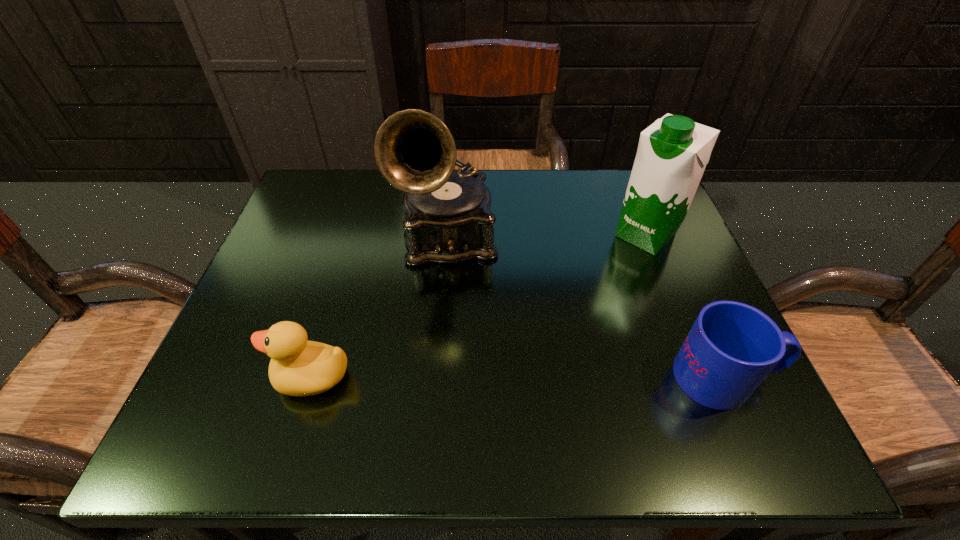
I want to click on free spot located on the front-facing side of the third shortest object, so click(x=593, y=287).

Where is `phonograph record positioned at the far edge`? This screenshot has width=960, height=540. phonograph record positioned at the far edge is located at coordinates (448, 220).

Locate an element on the screen. The width and height of the screenshot is (960, 540). soya milk that is at the far edge is located at coordinates (672, 154).

Where is `duck that is at the near edge`? The width and height of the screenshot is (960, 540). duck that is at the near edge is located at coordinates (298, 367).

This screenshot has width=960, height=540. I want to click on mug positioned at the near edge, so click(x=731, y=348).

Where is `object that is at the left edge`? object that is at the left edge is located at coordinates (298, 367).

Find the location of a particular element. mug at the right edge is located at coordinates (731, 348).

I want to click on soya milk that is at the right edge, so click(x=672, y=154).

Identify the location of object positioned at the near left corner. click(298, 367).

Locate an element on the screen. The image size is (960, 540). object located in the far right corner section of the desktop is located at coordinates (672, 154).